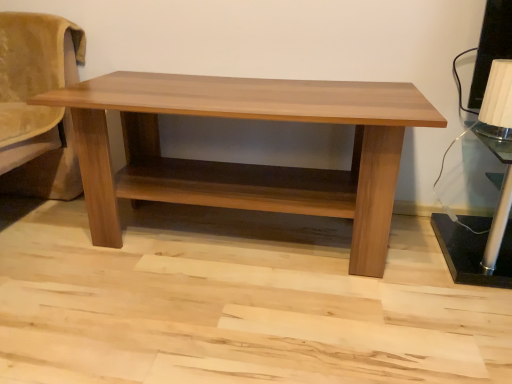
Where is `light brown wood table at center`? light brown wood table at center is located at coordinates [x=245, y=164].

Where is `white textured lampshade at upper right, which ranks as the 2th table lamp in bottom-to-top order`? white textured lampshade at upper right, which ranks as the 2th table lamp in bottom-to-top order is located at coordinates (497, 102).

You are a GUI agent. You are given a task and a screenshot of the screen. Output one action in this format:
    pyautogui.click(x=<x>, y=<y>)
    Task: Click on the table above the black metallic table lamp at right, the 1th table lamp in the bottom-to-top sequence (from the image's perspective)
    This screenshot has height=384, width=512.
    Given the screenshot: What is the action you would take?
    pyautogui.click(x=245, y=164)

Based on their positions, is black metallic table lamp at right, the 1th table lamp in the bottom-to-top sequence, located to the left or right of light brown wood table at center?

black metallic table lamp at right, the 1th table lamp in the bottom-to-top sequence, is to the right of light brown wood table at center.

Can you confirm if black metallic table lamp at right, the 1th table lamp in the bottom-to-top sequence, is thinner than light brown wood table at center?

Indeed, black metallic table lamp at right, the 1th table lamp in the bottom-to-top sequence, has a lesser width compared to light brown wood table at center.

Is black metallic table lamp at right, the 1th table lamp in the bottom-to-top sequence, oriented towards light brown wood table at center?

No, black metallic table lamp at right, the 1th table lamp in the bottom-to-top sequence, is not turned towards light brown wood table at center.

The image size is (512, 384). I want to click on table below the white textured lampshade at upper right, which ranks as the 2th table lamp in bottom-to-top order (from the image's perspective), so click(x=245, y=164).

Is light brown wood table at center facing towards white textured lampshade at upper right, which ranks as the 2th table lamp in bottom-to-top order?

No, light brown wood table at center is not aimed at white textured lampshade at upper right, which ranks as the 2th table lamp in bottom-to-top order.

From a real-world perspective, who is located higher, light brown wood table at center or white textured lampshade at upper right, the 1th table lamp positioned from the top?

white textured lampshade at upper right, the 1th table lamp positioned from the top.

Which is closer to the camera, [503,260] or [500,107]?

Point [503,260].

From a real-world perspective, which object rests below the other?

In real-world perspective, black metallic table lamp at right, the 1th table lamp in the bottom-to-top sequence, is lower.

Locate an element on the screen. This screenshot has height=384, width=512. table lamp on the right of white textured lampshade at upper right, the 1th table lamp positioned from the top is located at coordinates (497, 204).

Would you say light brown wood table at center is a long distance from black metallic table lamp at right, the 1th table lamp in the bottom-to-top sequence?

No.

Who is taller, light brown wood table at center or black metallic table lamp at right, which appears as the 2th table lamp when viewed from the top?

light brown wood table at center is taller.

How distant is light brown wood table at center from black metallic table lamp at right, which appears as the 2th table lamp when viewed from the top?

light brown wood table at center is 24.25 inches away from black metallic table lamp at right, which appears as the 2th table lamp when viewed from the top.

Who is more distant, light brown wood table at center or black metallic table lamp at right, the 1th table lamp in the bottom-to-top sequence?

black metallic table lamp at right, the 1th table lamp in the bottom-to-top sequence, is further from the camera.

How much distance is there between white textured lampshade at upper right, which ranks as the 2th table lamp in bottom-to-top order, and black metallic table lamp at right, which appears as the 2th table lamp when viewed from the top?

They are 7.65 inches apart.

From the image's perspective, relative to black metallic table lamp at right, which appears as the 2th table lamp when viewed from the top, is white textured lampshade at upper right, the 1th table lamp positioned from the top, above or below?

Based on their image positions, white textured lampshade at upper right, the 1th table lamp positioned from the top, is located above black metallic table lamp at right, which appears as the 2th table lamp when viewed from the top.

Is white textured lampshade at upper right, which ranks as the 2th table lamp in bottom-to-top order, aimed at black metallic table lamp at right, the 1th table lamp in the bottom-to-top sequence?

No, white textured lampshade at upper right, which ranks as the 2th table lamp in bottom-to-top order, does not turn towards black metallic table lamp at right, the 1th table lamp in the bottom-to-top sequence.

From a real-world perspective, is white textured lampshade at upper right, which ranks as the 2th table lamp in bottom-to-top order, on top of black metallic table lamp at right, the 1th table lamp in the bottom-to-top sequence?

Indeed, from a real-world perspective, white textured lampshade at upper right, which ranks as the 2th table lamp in bottom-to-top order, stands above black metallic table lamp at right, the 1th table lamp in the bottom-to-top sequence.

Is white textured lampshade at upper right, the 1th table lamp positioned from the top, placed right next to light brown wood table at center?

No.

From the image's perspective, would you say white textured lampshade at upper right, which ranks as the 2th table lamp in bottom-to-top order, is positioned over light brown wood table at center?

Yes, from the image's perspective, white textured lampshade at upper right, which ranks as the 2th table lamp in bottom-to-top order, is over light brown wood table at center.

Can you confirm if white textured lampshade at upper right, which ranks as the 2th table lamp in bottom-to-top order, is positioned to the right of light brown wood table at center?

Yes, white textured lampshade at upper right, which ranks as the 2th table lamp in bottom-to-top order, is to the right of light brown wood table at center.

Considering the positions of objects white textured lampshade at upper right, which ranks as the 2th table lamp in bottom-to-top order, and light brown wood table at center in the image provided, who is in front, white textured lampshade at upper right, which ranks as the 2th table lamp in bottom-to-top order, or light brown wood table at center?

light brown wood table at center is in front.

Locate an element on the screen. This screenshot has height=384, width=512. table that is above the black metallic table lamp at right, which appears as the 2th table lamp when viewed from the top (from a real-world perspective) is located at coordinates (245, 164).

This screenshot has width=512, height=384. I want to click on table lamp above the light brown wood table at center (from the image's perspective), so click(x=497, y=102).

Looking at the image, which one is located further to white textured lampshade at upper right, which ranks as the 2th table lamp in bottom-to-top order, black metallic table lamp at right, the 1th table lamp in the bottom-to-top sequence, or light brown wood table at center?

light brown wood table at center lies further to white textured lampshade at upper right, which ranks as the 2th table lamp in bottom-to-top order, than the other object.

From the image, which object appears to be nearer to white textured lampshade at upper right, which ranks as the 2th table lamp in bottom-to-top order, light brown wood table at center or black metallic table lamp at right, which appears as the 2th table lamp when viewed from the top?

black metallic table lamp at right, which appears as the 2th table lamp when viewed from the top, is positioned closer to the anchor white textured lampshade at upper right, which ranks as the 2th table lamp in bottom-to-top order.

Estimate the real-world distances between objects in this image. Which object is closer to black metallic table lamp at right, which appears as the 2th table lamp when viewed from the top, light brown wood table at center or white textured lampshade at upper right, which ranks as the 2th table lamp in bottom-to-top order?

Based on the image, white textured lampshade at upper right, which ranks as the 2th table lamp in bottom-to-top order, appears to be nearer to black metallic table lamp at right, which appears as the 2th table lamp when viewed from the top.

Looking at the image, which one is located closer to light brown wood table at center, white textured lampshade at upper right, the 1th table lamp positioned from the top, or black metallic table lamp at right, the 1th table lamp in the bottom-to-top sequence?

black metallic table lamp at right, the 1th table lamp in the bottom-to-top sequence, is closer to light brown wood table at center.

From the image, which object appears to be nearer to black metallic table lamp at right, which appears as the 2th table lamp when viewed from the top, white textured lampshade at upper right, which ranks as the 2th table lamp in bottom-to-top order, or light brown wood table at center?

Based on the image, white textured lampshade at upper right, which ranks as the 2th table lamp in bottom-to-top order, appears to be nearer to black metallic table lamp at right, which appears as the 2th table lamp when viewed from the top.

From the image, which object appears to be nearer to light brown wood table at center, black metallic table lamp at right, which appears as the 2th table lamp when viewed from the top, or white textured lampshade at upper right, which ranks as the 2th table lamp in bottom-to-top order?

Among the two, black metallic table lamp at right, which appears as the 2th table lamp when viewed from the top, is located nearer to light brown wood table at center.

Identify the location of table lamp between light brown wood table at center and black metallic table lamp at right, which appears as the 2th table lamp when viewed from the top, in the horizontal direction. This screenshot has height=384, width=512. (497, 102).